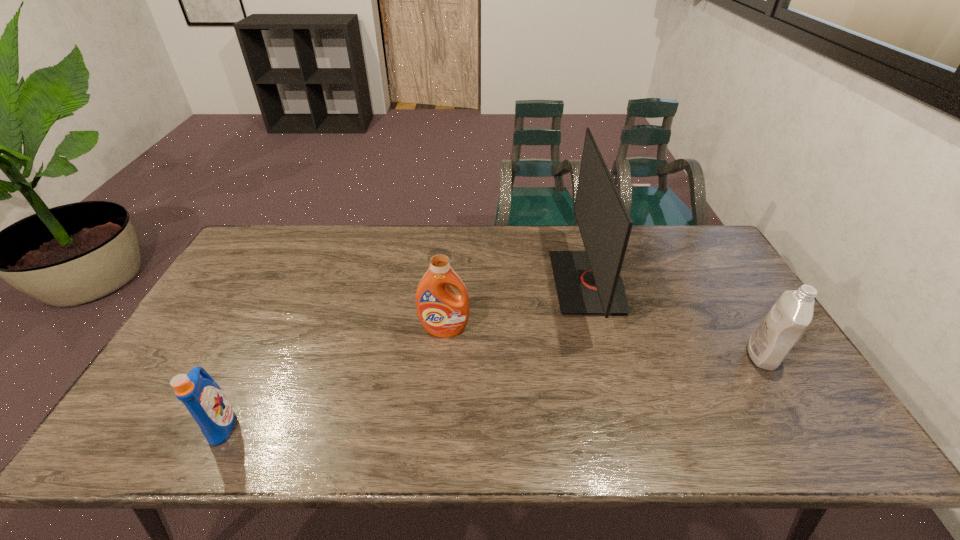
Where is `free space between the monitor and the rightmost object`? free space between the monitor and the rightmost object is located at coordinates (675, 319).

In order to click on free space between the monitor and the farthest detergent in this screenshot , I will do `click(516, 306)`.

I want to click on free space between the third object from left to right and the rightmost object, so click(x=675, y=319).

You are a GUI agent. You are given a task and a screenshot of the screen. Output one action in this format:
    pyautogui.click(x=<x>, y=<y>)
    Task: Click on the vacant space that is in between the rightmost detergent and the monitor
    
    Given the screenshot: What is the action you would take?
    pyautogui.click(x=675, y=319)

Image resolution: width=960 pixels, height=540 pixels. What are the coordinates of `object that is the nearest to the nearest detergent` in the screenshot? It's located at (442, 313).

Where is `object that is the third nearest to the second farthest detergent`? The image size is (960, 540). object that is the third nearest to the second farthest detergent is located at coordinates coord(204,399).

The width and height of the screenshot is (960, 540). I want to click on detergent that is the closest one to the tallest object, so click(442, 313).

Choose which detergent is the second nearest neighbor to the rightmost object. Please provide its 2D coordinates. Your answer should be formatted as a tuple, i.e. [(x, y)], where the tuple contains the x and y coordinates of a point satisfying the conditions above.

[(204, 399)]

The height and width of the screenshot is (540, 960). What are the coordinates of `free space that satisfies the following two spatial constraints: 1. on the front-facing side of the second object from left to right; 2. on the label of the nearest object` in the screenshot? It's located at (437, 424).

This screenshot has height=540, width=960. Find the location of `vacant area that satisfies the following two spatial constraints: 1. on the screen side of the third object from left to right; 2. on the front-facing side of the farthest detergent`. vacant area that satisfies the following two spatial constraints: 1. on the screen side of the third object from left to right; 2. on the front-facing side of the farthest detergent is located at coordinates pos(601,330).